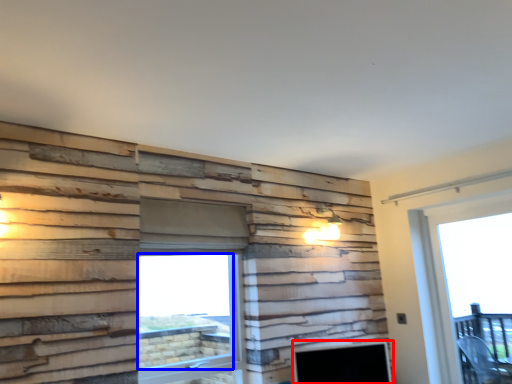
Question: Among these objects, which one is farthest to the camera, fireplace (highlighted by a red box) or window screen (highlighted by a blue box)?

Choices:
 (A) fireplace
 (B) window screen

Answer: (A)